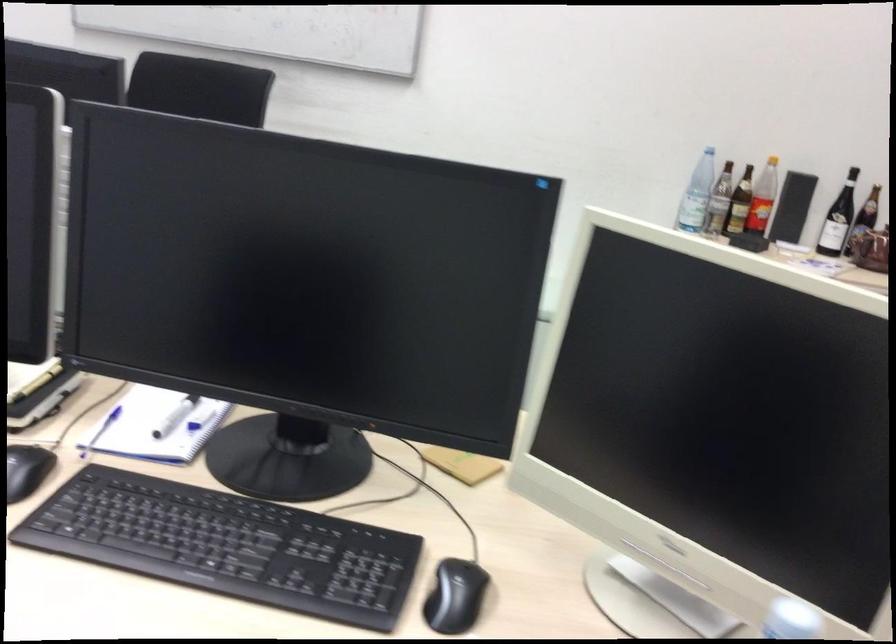
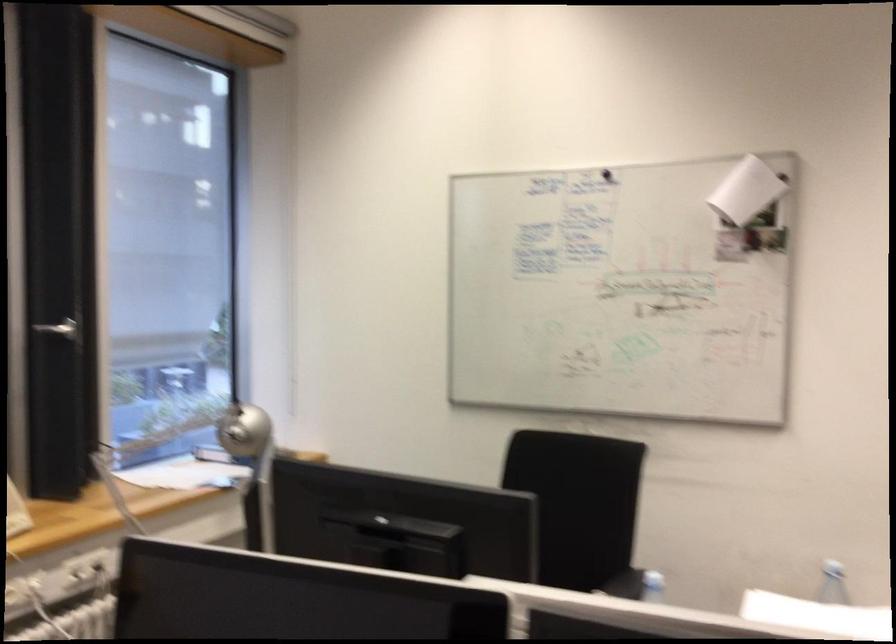
Based on the continuous images, in which direction is the camera rotating?

The camera rotated toward left-up.